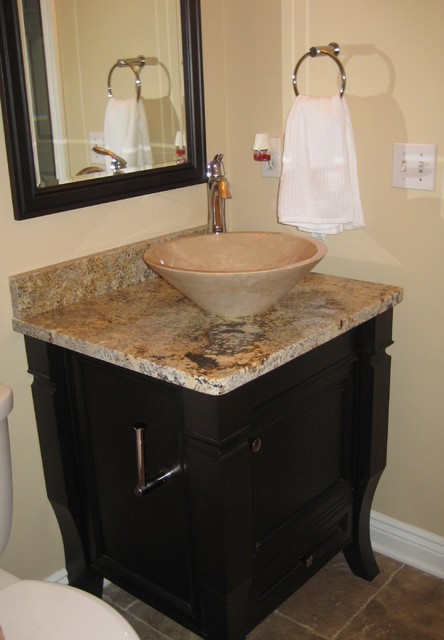
You are a GUI agent. You are given a task and a screenshot of the screen. Output one action in this format:
    pyautogui.click(x=<x>, y=<y>)
    Task: Click on the toilet
    The height and width of the screenshot is (640, 444).
    Given the screenshot: What is the action you would take?
    pyautogui.click(x=48, y=621)